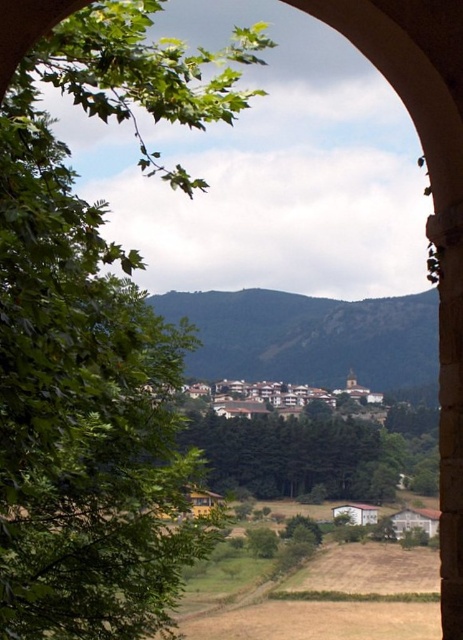
Can you confirm if green leafy tree at left is wider than green leafy tree at center?

Incorrect, green leafy tree at left's width does not surpass green leafy tree at center's.

Does green leafy tree at left appear under green leafy tree at center?

Incorrect, green leafy tree at left is not positioned below green leafy tree at center.

Between point (70, 356) and point (238, 433), which one is positioned behind?

The point (238, 433) is more distant.

Where is `green leafy tree at left`? The height and width of the screenshot is (640, 463). green leafy tree at left is located at coordinates (93, 340).

Is green leafy tree at left positioned in front of green grassy hill at center?

Yes, green leafy tree at left is closer to the viewer.

Does green leafy tree at left appear over green grassy hill at center?

Yes.

The height and width of the screenshot is (640, 463). Find the location of `green leafy tree at left`. green leafy tree at left is located at coordinates (93, 340).

Is the position of green grassy hill at center less distant than that of green leafy tree at center?

No, green grassy hill at center is behind green leafy tree at center.

Does green grassy hill at center come behind green leafy tree at center?

Yes, green grassy hill at center is further from the viewer.

Is point (431, 372) behind point (343, 433)?

Yes, it is.

Identify the location of green grassy hill at center. The width and height of the screenshot is (463, 640). (308, 337).